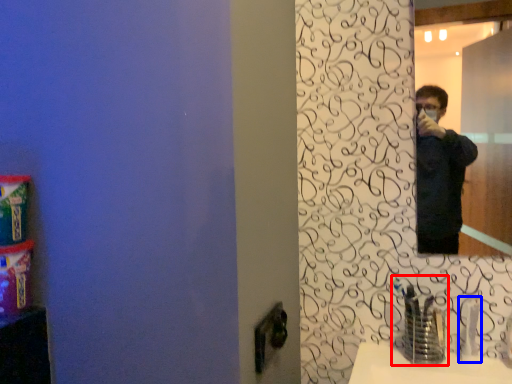
Question: Which of the following is the closest to the observer, faucet (highlighted by a red box) or faucet (highlighted by a blue box)?

Choices:
 (A) faucet
 (B) faucet

Answer: (A)